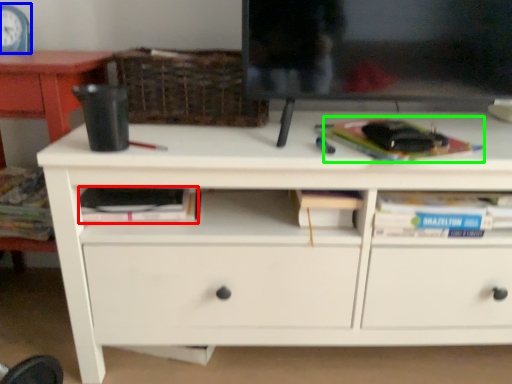
Question: Considering the real-world distances, which object is closest to paperback book (highlighted by a red box)? clock (highlighted by a blue box) or paperback book (highlighted by a green box).

Choices:
 (A) clock
 (B) paperback book

Answer: (B)